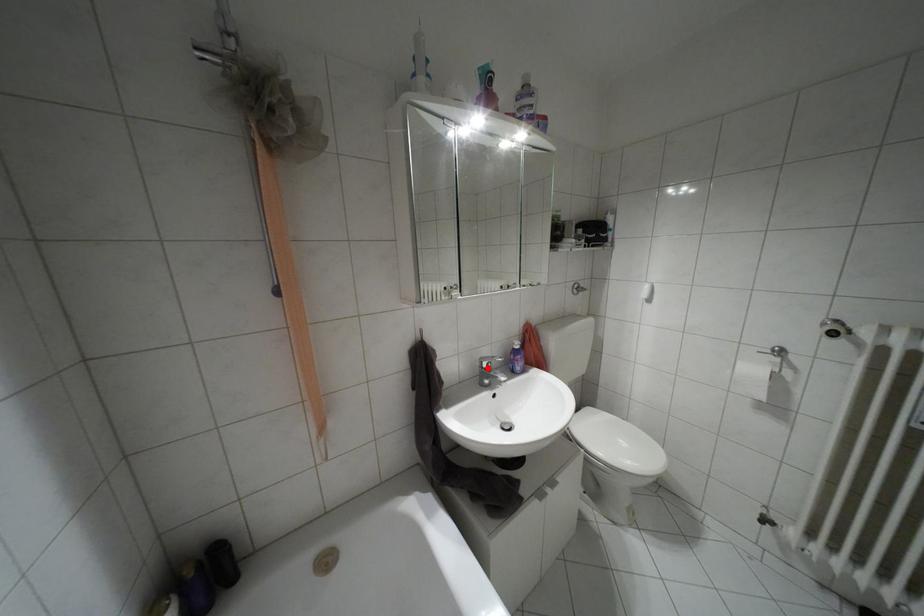
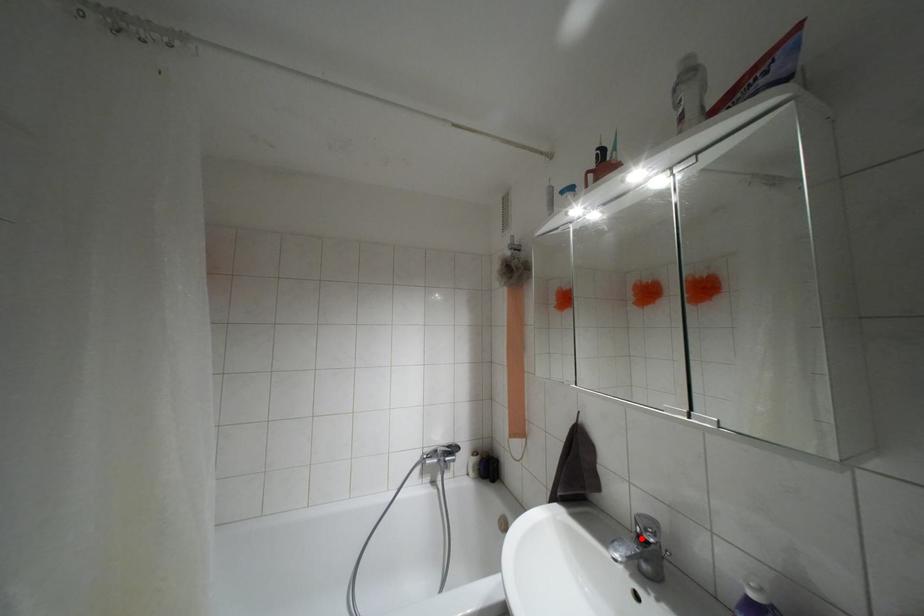
In the scene shown: I am providing you with two images of the same scene from different viewpoints. A red point is marked on the first image and another point is marked on the second image. Is the marked point in image1 the same physical position as the marked point in image2?

Yes